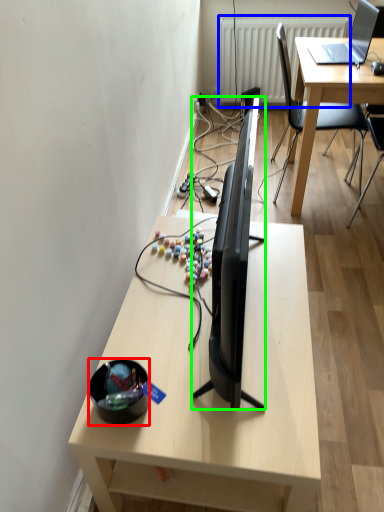
Question: Which object is the closest to the bowl (highlighted by a red box)? Choose among these: radiator (highlighted by a blue box) or television (highlighted by a green box).

Choices:
 (A) radiator
 (B) television

Answer: (B)